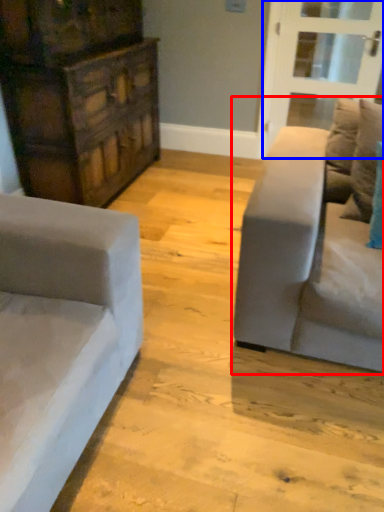
Question: Which object appears closest to the camera in this image, studio couch (highlighted by a red box) or glass door (highlighted by a blue box)?

Choices:
 (A) studio couch
 (B) glass door

Answer: (A)